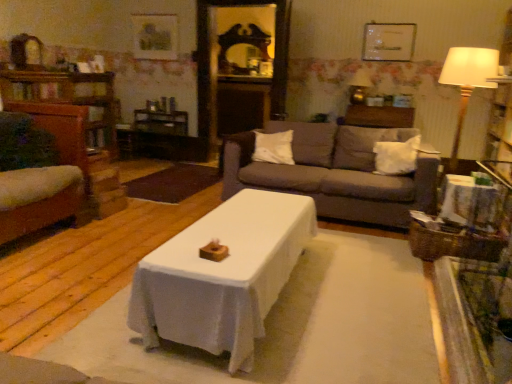
Find the location of a particular element. unoccupied region to the right of wooden swivel chair at left is located at coordinates (100, 240).